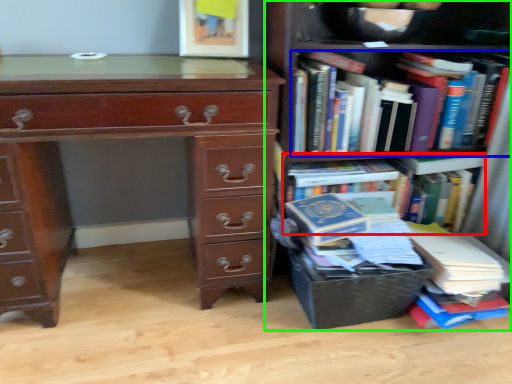
Question: Considering the real-world distances, which object is farthest from book (highlighted by a red box)? book (highlighted by a blue box) or bookcase (highlighted by a green box)?

Choices:
 (A) book
 (B) bookcase

Answer: (B)